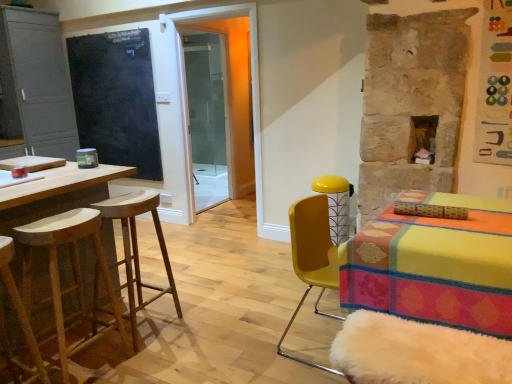
Locate an element on the screen. This screenshot has height=384, width=512. free region under yellow matte chair at right (from a real-world perspective) is located at coordinates (317, 341).